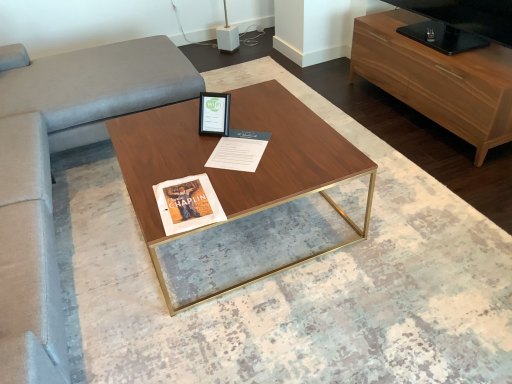
The width and height of the screenshot is (512, 384). Identify the location of free space between matte black picture frame at center and white paper at center. (208, 140).